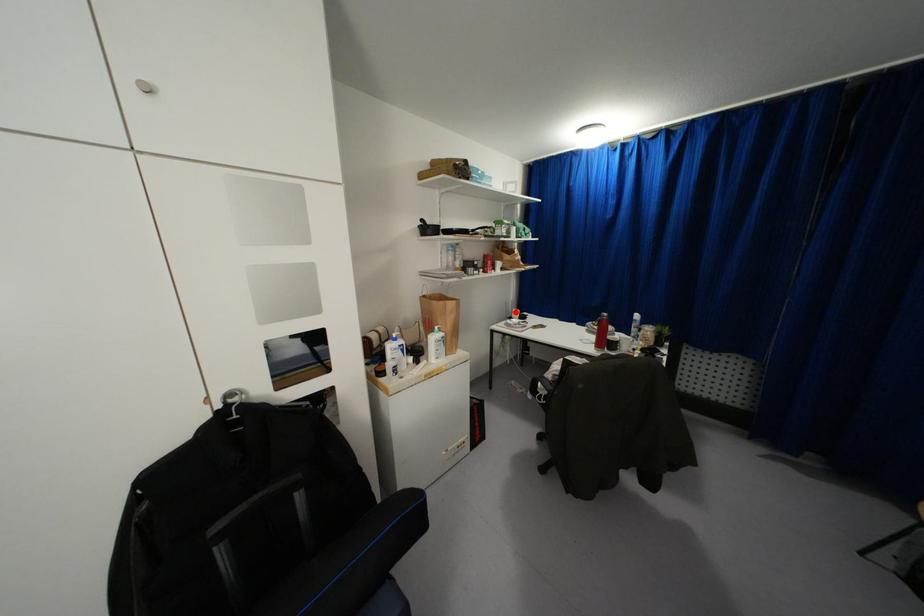
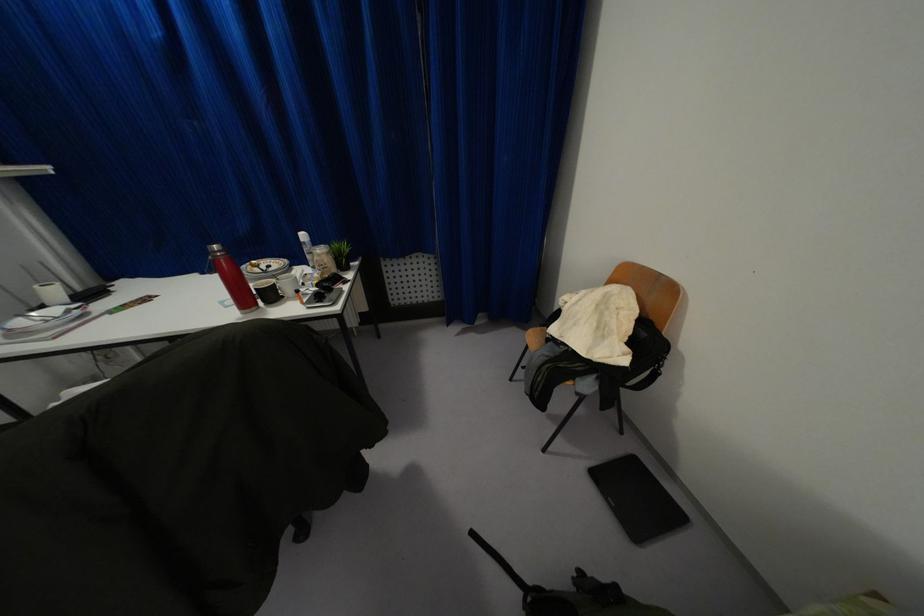
Find the pixel in the second image that matches the highlighted location in the first image.

(53, 291)